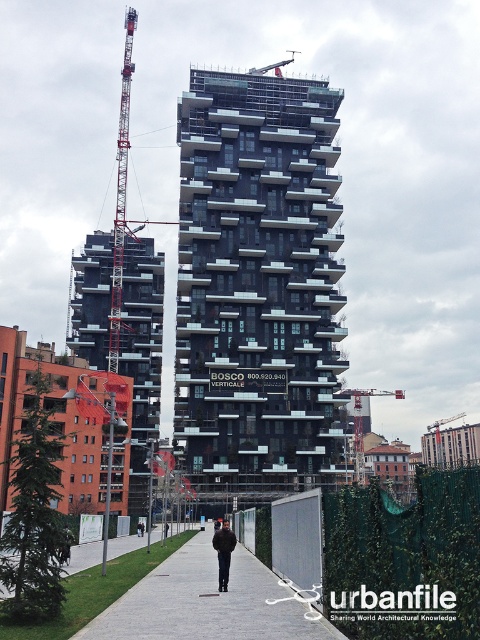
Can you confirm if gray concrete pavement at lower center is shorter than black leather jacket at center?

Yes, gray concrete pavement at lower center is shorter than black leather jacket at center.

Can you confirm if gray concrete pavement at lower center is taller than black leather jacket at center?

No.

What do you see at coordinates (207, 602) in the screenshot?
I see `gray concrete pavement at lower center` at bounding box center [207, 602].

Find the location of a particular element. gray concrete pavement at lower center is located at coordinates (207, 602).

Which is more to the right, red metal crane at upper left or metallic construction crane at center?

metallic construction crane at center is more to the right.

Can you confirm if red metal crane at upper left is taller than metallic construction crane at center?

Yes.

From the picture: Measure the distance between point (126, 84) and camera.

A distance of 887.36 feet exists between point (126, 84) and camera.

Find the location of a particular element. This screenshot has height=640, width=480. red metal crane at upper left is located at coordinates (120, 195).

Can you confirm if metallic construction crane at center is positioned above black leather jacket at center?

No.

Between metallic construction crane at center and black leather jacket at center, which one is positioned higher?

black leather jacket at center

Which is in front, point (356, 445) or point (225, 548)?

Point (225, 548)

In order to click on metallic construction crane at center in this screenshot , I will do `click(361, 422)`.